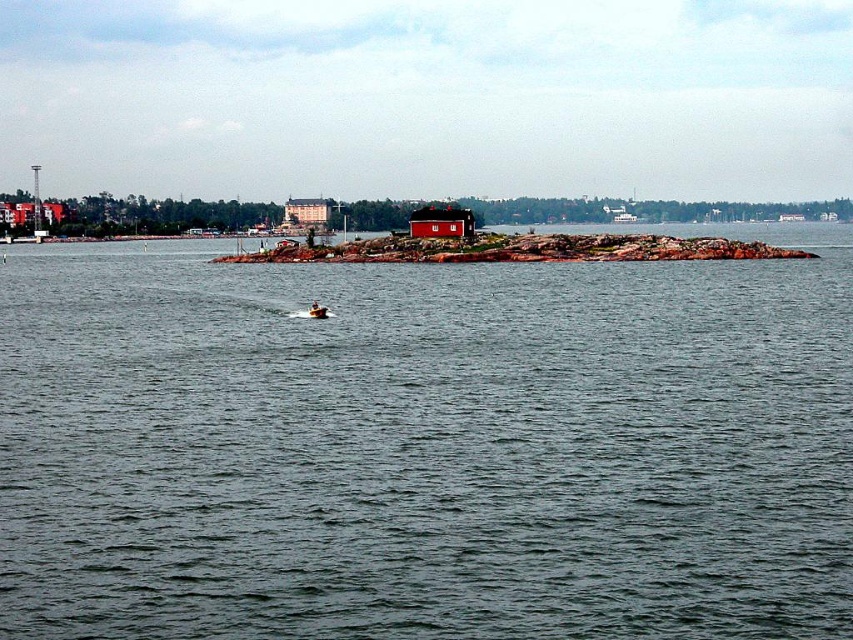
You are a tourist standing on the shore looking at the scene. You see the red stone island at center and the red matte house at center. Which one appears nearer to you?

The red stone island at center appears nearer to you because it is closer to the viewer than the red matte house at center.

From the picture: You are a photographer planning to take a picture of the red matte house at center and the orange fiberglass boat at center from a distance. Considering their heights, which object will appear larger in the photo?

The red matte house at center will appear larger in the photo because it is taller than the orange fiberglass boat at center.

You are a photographer planning to take a wide shot of the red matte house at center and the orange fiberglass boat at center from a distance. Based on their sizes, which object would appear larger in the photo?

The red matte house at center would appear larger in the photo since its width surpasses that of the orange fiberglass boat at center.